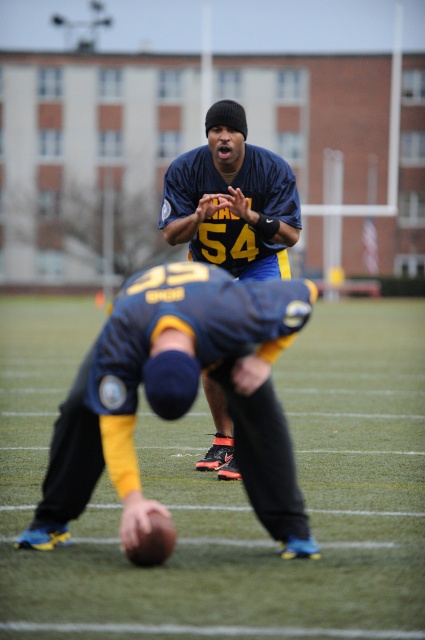
You are a soccer player who needs to place a 1.2 meter wide equipment box on the field. Based on the scene, can the green artificial turf at center accommodate the box without overlapping the matte blue jersey at center?

The green artificial turf at center might be wider than matte blue jersey at center, so there is a possibility that the equipment box can be placed without overlapping, but the exact dimensions are uncertain. Check the field layout carefully before placing the box.